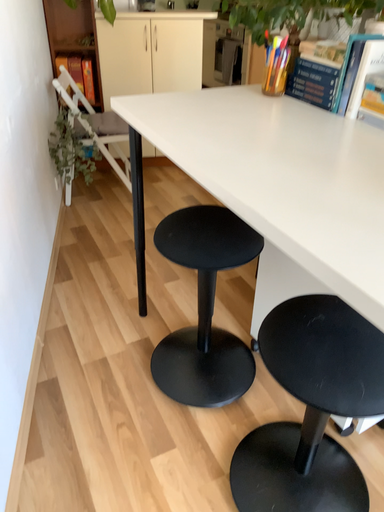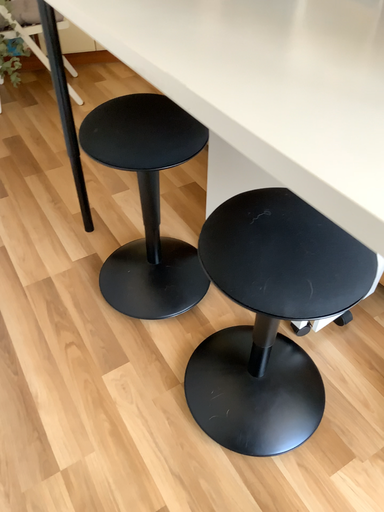
Question: How did the camera likely rotate when shooting the video?

Choices:
 (A) rotated upward
 (B) rotated downward

Answer: (B)